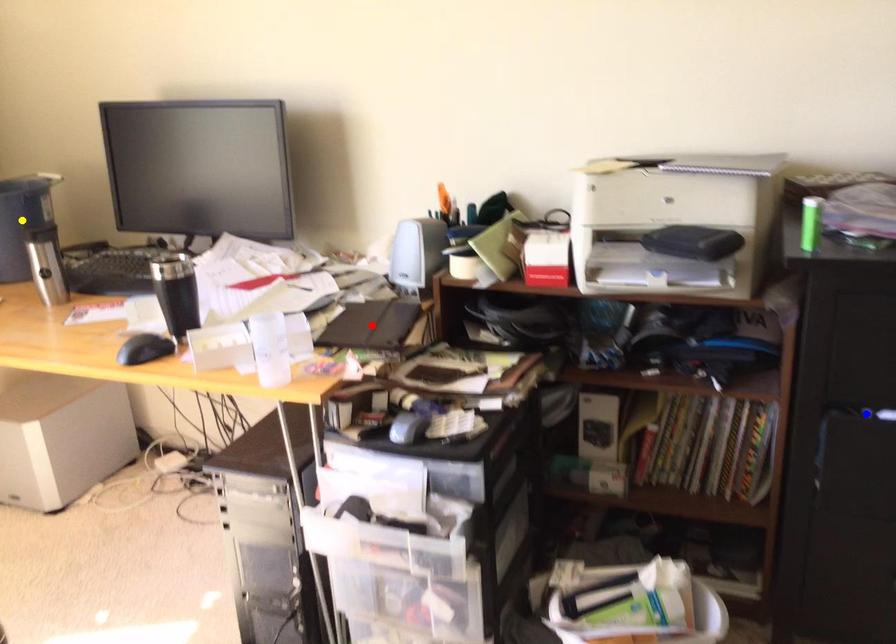
Order these from nearest to farthest:
1. yellow point
2. red point
3. blue point

1. blue point
2. red point
3. yellow point